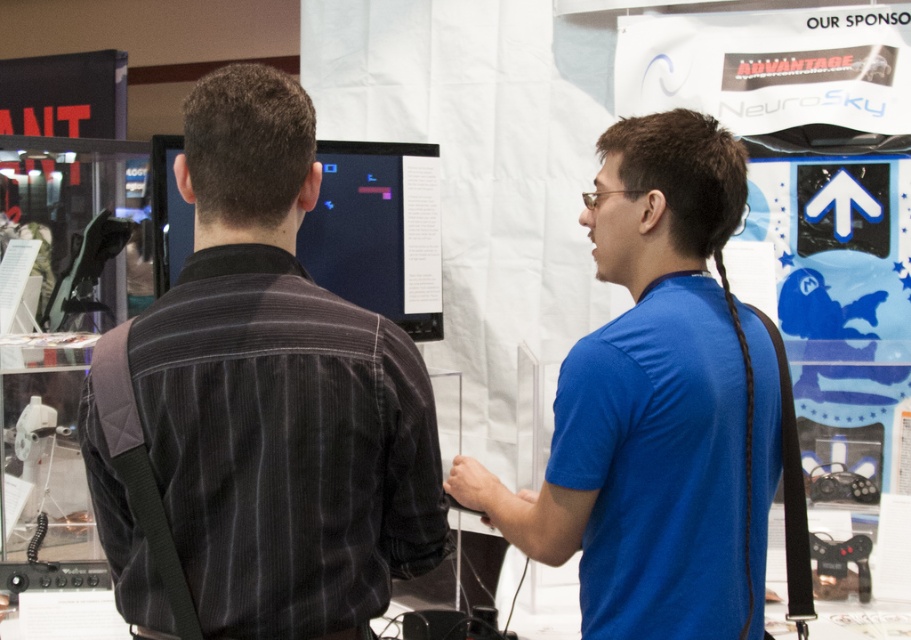
Question: Does dark gray corduroy shirt at center have a larger size compared to blue cotton shirt at center?

Choices:
 (A) no
 (B) yes

Answer: (A)

Question: Does dark gray corduroy shirt at center appear over blue cotton shirt at center?

Choices:
 (A) no
 (B) yes

Answer: (B)

Question: Which point is farther from the camera taking this photo?

Choices:
 (A) (758, 564)
 (B) (347, 376)

Answer: (A)

Question: Does dark gray corduroy shirt at center appear under blue cotton shirt at center?

Choices:
 (A) yes
 (B) no

Answer: (B)